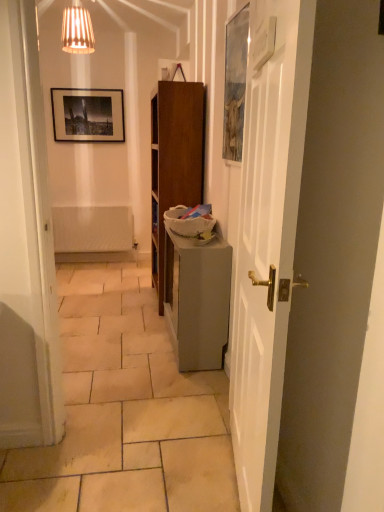
What do you see at coordinates (261, 278) in the screenshot?
I see `white wooden door at right` at bounding box center [261, 278].

Locate an element on the screen. This screenshot has height=512, width=384. white wooden door at right is located at coordinates (261, 278).

What do you see at coordinates (197, 298) in the screenshot? The height and width of the screenshot is (512, 384). I see `matte gray table at center` at bounding box center [197, 298].

The height and width of the screenshot is (512, 384). I want to click on matte gray table at center, so click(197, 298).

This screenshot has width=384, height=512. What are the coordinates of `white wooden door at right` in the screenshot? It's located at (261, 278).

Which is more to the left, matte gray table at center or white wooden door at right?

matte gray table at center is more to the left.

Based on the photo, does matte gray table at center come in front of white wooden door at right?

No, matte gray table at center is further to the viewer.

Does point (222, 367) come in front of point (274, 213)?

No, it is not.

In the scene shown: From the image's perspective, is matte gray table at center located above white wooden door at right?

No, from the image's perspective, matte gray table at center is not on top of white wooden door at right.

From a real-world perspective, which object rests below the other?

matte gray table at center is physically lower.

In terms of width, does matte gray table at center look wider or thinner when compared to white wooden door at right?

matte gray table at center is wider than white wooden door at right.

Can you confirm if matte gray table at center is taller than white wooden door at right?

No, matte gray table at center is not taller than white wooden door at right.

Does matte gray table at center have a smaller size compared to white wooden door at right?

Incorrect, matte gray table at center is not smaller in size than white wooden door at right.

Is matte gray table at center positioned beyond the bounds of white wooden door at right?

matte gray table at center lies outside white wooden door at right's area.

Is matte gray table at center touching white wooden door at right?

matte gray table at center is not next to white wooden door at right, and they're not touching.

Based on the photo, is white wooden door at right at the back of matte gray table at center?

No.

How many degrees apart are the facing directions of matte gray table at center and white wooden door at right?

The angular difference between matte gray table at center and white wooden door at right is 10.7 degrees.

Measure the distance from matte gray table at center to white wooden door at right.

The distance of matte gray table at center from white wooden door at right is 27.41 inches.

Find the location of a particular element. This screenshot has height=512, width=384. door above the matte gray table at center (from the image's perspective) is located at coordinates (261, 278).

Would you say white wooden door at right is to the left or to the right of matte gray table at center in the picture?

From the image, it's evident that white wooden door at right is to the right of matte gray table at center.

Which object is further away from the camera taking this photo, white wooden door at right or matte gray table at center?

matte gray table at center is further from the camera.

Between point (266, 485) and point (229, 306), which one is positioned in front?

Point (266, 485)

From the image's perspective, is white wooden door at right below matte gray table at center?

No.

From a real-world perspective, relative to matte gray table at center, is white wooden door at right vertically above or below?

Clearly, from a real-world perspective, white wooden door at right is above matte gray table at center.

Looking at their sizes, would you say white wooden door at right is wider or thinner than matte gray table at center?

Clearly, white wooden door at right has less width compared to matte gray table at center.

Does white wooden door at right have a lesser height compared to matte gray table at center?

Incorrect, the height of white wooden door at right does not fall short of that of matte gray table at center.

Considering the relative sizes of white wooden door at right and matte gray table at center in the image provided, is white wooden door at right smaller than matte gray table at center?

Correct, white wooden door at right occupies less space than matte gray table at center.

Choose the correct answer: Is white wooden door at right inside matte gray table at center or outside it?

white wooden door at right exists outside the volume of matte gray table at center.

Is white wooden door at right in contact with matte gray table at center?

There is a gap between white wooden door at right and matte gray table at center.

Could you tell me if white wooden door at right is turned towards matte gray table at center?

No, white wooden door at right does not turn towards matte gray table at center.

What's the angular difference between white wooden door at right and matte gray table at center's facing directions?

10.7 degrees separate the facing orientations of white wooden door at right and matte gray table at center.

Where is `table below the white wooden door at right (from the image's perspective)`? The width and height of the screenshot is (384, 512). table below the white wooden door at right (from the image's perspective) is located at coordinates (197, 298).

Locate an element on the screen. The height and width of the screenshot is (512, 384). table on the left side of white wooden door at right is located at coordinates (197, 298).

I want to click on table behind the white wooden door at right, so click(197, 298).